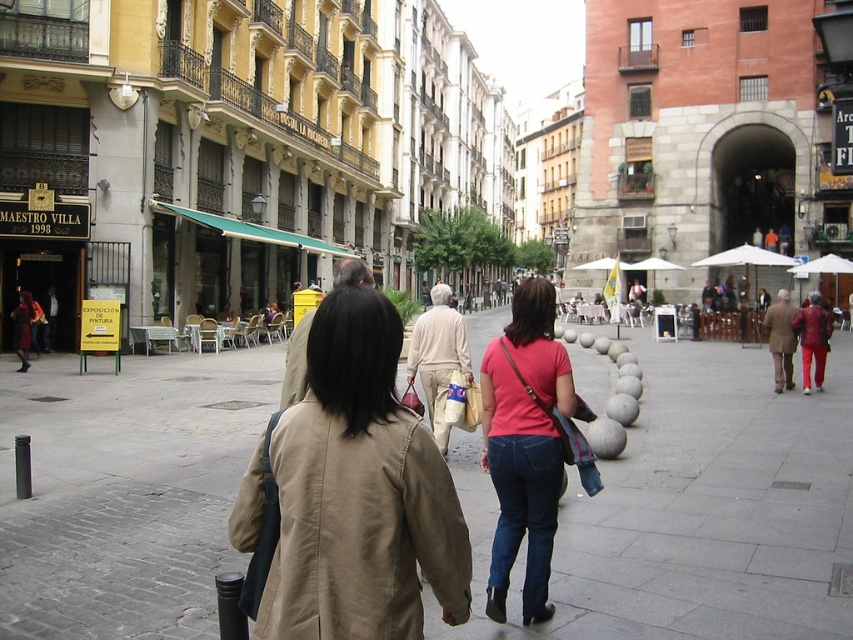
Question: Which of these objects is positioned farthest from the gray concrete pavement at center?

Choices:
 (A) matte pink shirt at center
 (B) tan fabric trench coat at center

Answer: (A)

Question: Which point appears farthest from the camera in this image?

Choices:
 (A) (537, 422)
 (B) (329, 445)

Answer: (A)

Question: Does gray concrete pavement at center come in front of matte pink shirt at center?

Choices:
 (A) no
 (B) yes

Answer: (A)

Question: Which of the following is the closest to the observer?

Choices:
 (A) (67, 570)
 (B) (383, 387)
 (C) (548, 496)

Answer: (B)

Question: Does gray concrete pavement at center come in front of matte pink shirt at center?

Choices:
 (A) yes
 (B) no

Answer: (B)

Question: Is gray concrete pavement at center further to camera compared to tan fabric trench coat at center?

Choices:
 (A) no
 (B) yes

Answer: (B)